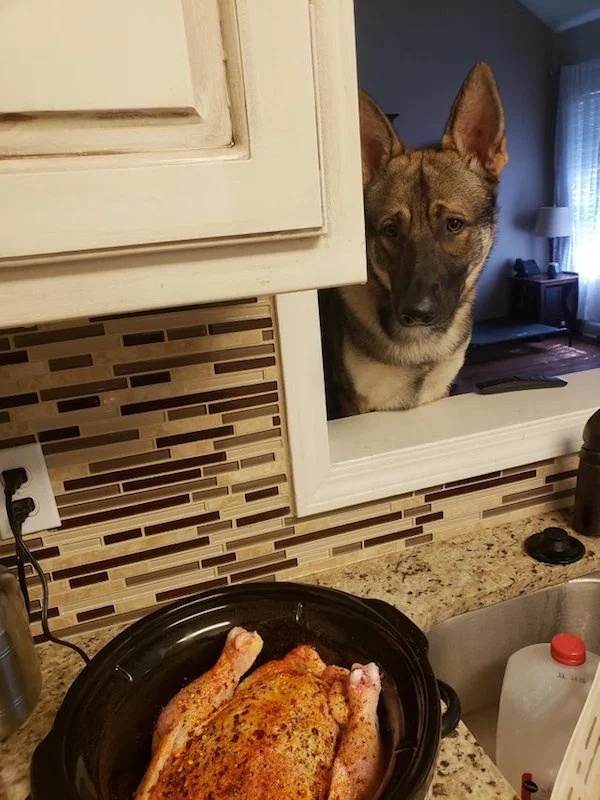
Identify the location of granite countertop. The image size is (600, 800). (445, 582).